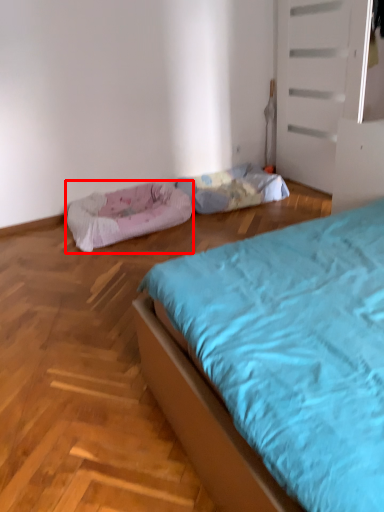
Question: From the image, what is the correct spatial relationship of dog bed (annotated by the red box) in relation to blanket?

Choices:
 (A) right
 (B) left

Answer: (B)